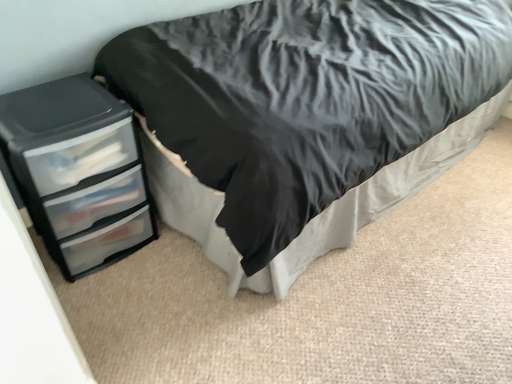
Question: Is black matte bed at left oriented towards black plastic chest of drawers at left?

Choices:
 (A) no
 (B) yes

Answer: (B)

Question: Is black matte bed at left bigger than black plastic chest of drawers at left?

Choices:
 (A) no
 (B) yes

Answer: (B)

Question: Considering the relative sizes of black matte bed at left and black plastic chest of drawers at left in the image provided, is black matte bed at left shorter than black plastic chest of drawers at left?

Choices:
 (A) yes
 (B) no

Answer: (B)

Question: Is black matte bed at left touching black plastic chest of drawers at left?

Choices:
 (A) yes
 (B) no

Answer: (B)

Question: Is black matte bed at left located outside black plastic chest of drawers at left?

Choices:
 (A) no
 (B) yes

Answer: (B)

Question: Considering the relative sizes of black matte bed at left and black plastic chest of drawers at left in the image provided, is black matte bed at left wider than black plastic chest of drawers at left?

Choices:
 (A) no
 (B) yes

Answer: (B)

Question: Does black plastic chest of drawers at left appear on the right side of black matte bed at left?

Choices:
 (A) no
 (B) yes

Answer: (A)

Question: From the image's perspective, is black plastic chest of drawers at left beneath black matte bed at left?

Choices:
 (A) no
 (B) yes

Answer: (B)

Question: Can you confirm if black plastic chest of drawers at left is bigger than black matte bed at left?

Choices:
 (A) no
 (B) yes

Answer: (A)

Question: From a real-world perspective, is black plastic chest of drawers at left physically above black matte bed at left?

Choices:
 (A) no
 (B) yes

Answer: (A)

Question: Is black plastic chest of drawers at left in contact with black matte bed at left?

Choices:
 (A) yes
 (B) no

Answer: (B)

Question: Is black matte bed at left completely or partially inside black plastic chest of drawers at left?

Choices:
 (A) yes
 (B) no

Answer: (B)

Question: From their relative heights in the image, would you say black plastic chest of drawers at left is taller or shorter than black matte bed at left?

Choices:
 (A) tall
 (B) short

Answer: (B)